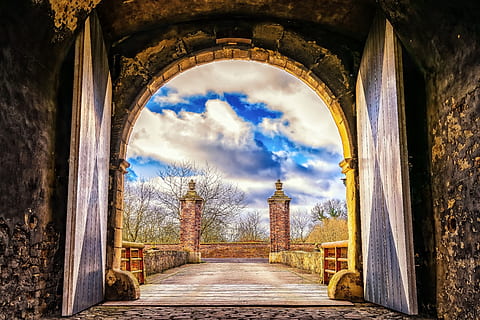
You are a GUI agent. You are given a task and a screenshot of the screen. Output one action in this format:
    pyautogui.click(x=<x>, y=<y>)
    Task: Click on the left door
    The image size is (480, 320).
    Given the screenshot: What is the action you would take?
    pyautogui.click(x=374, y=105)